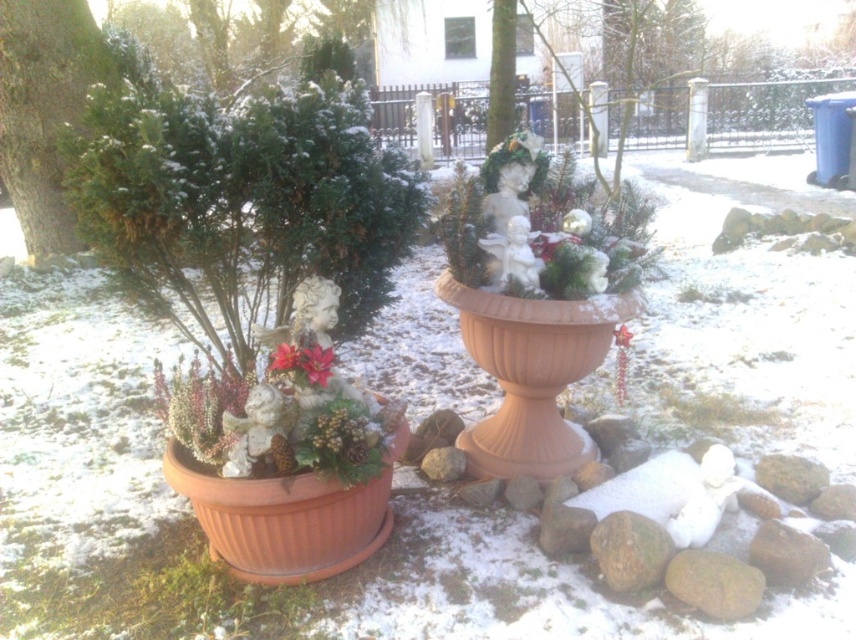
You are a photographer standing at the camera position. You want to take a closeup photo of the poinsettia matte at center. Can you step forward to get closer without moving the camera tripod? Explain why or why not.

The poinsettia matte at center and camera are 1.66 meters apart. Since you can move closer by stepping forward, you can reduce the distance to less than 1.66 meters, allowing for a closer photo.

You are standing in the winter garden scene. You want to place a new decorative item between the green textured evergreen tree at left and the matte red flower at center. What is the minimum distance you need to maintain between them to ensure the item fits comfortably?

The minimum distance you need to maintain between the green textured evergreen tree at left and the matte red flower at center is 11.32 feet to ensure the item fits comfortably.

You are planning to decorate a holiday table and need to choose between the poinsettia matte at center and the matte red flower at center. Based on their sizes, which would be more suitable for a centerpiece that needs to fill the space effectively?

The poinsettia matte at center is larger in size than the matte red flower at center, making it more suitable for a centerpiece that needs to fill the space effectively.